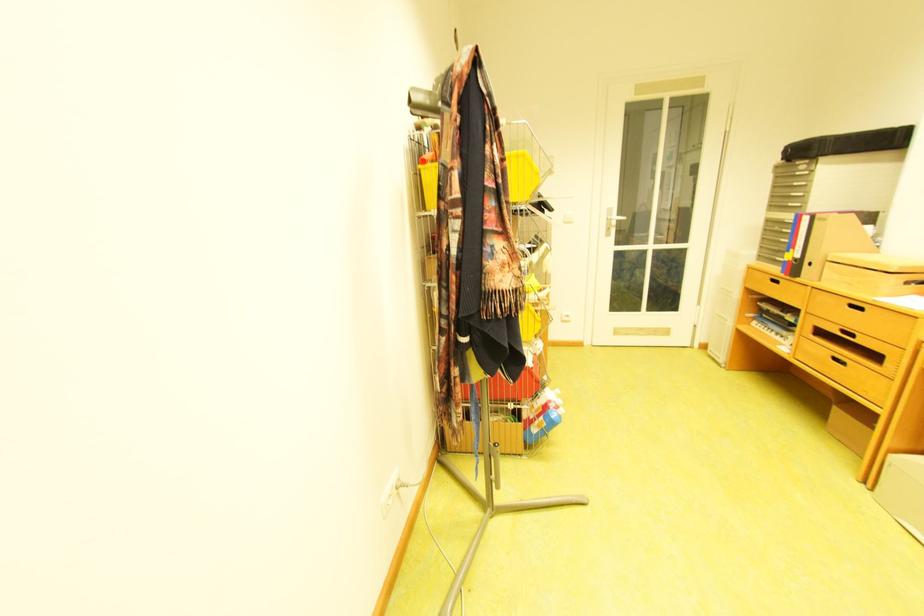
Which object does [523,365] point to?

It refers to a red plastic container.